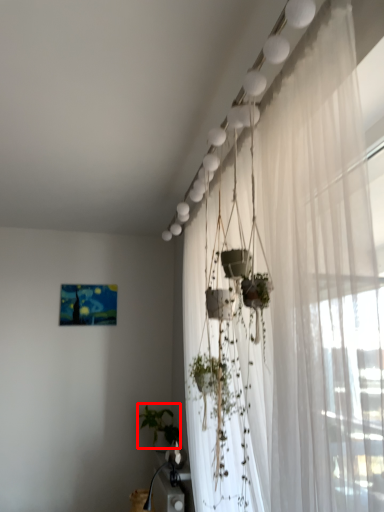
Question: Where is plant (annotated by the red box) located in relation to curtain in the image?

Choices:
 (A) right
 (B) left

Answer: (B)